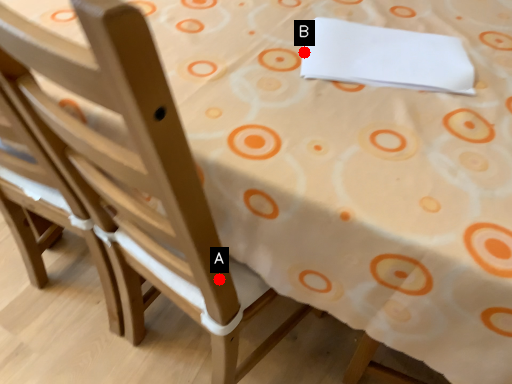
Question: Two points are circled on the image, labeled by A and B beside each circle. Which point appears closest to the camera in this image?

Choices:
 (A) A is closer
 (B) B is closer

Answer: (A)